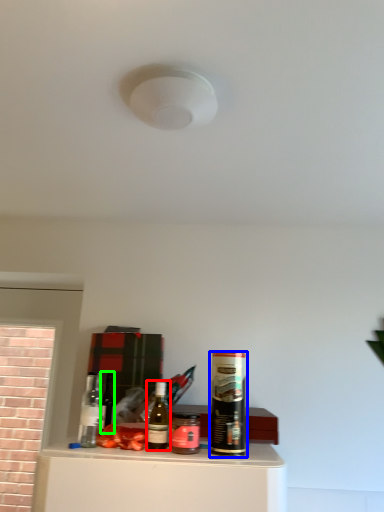
Question: Which object is the farthest from bottle (highlighted by a red box)? Choose among these: beverage (highlighted by a blue box) or wine bottle (highlighted by a green box).

Choices:
 (A) beverage
 (B) wine bottle

Answer: (B)